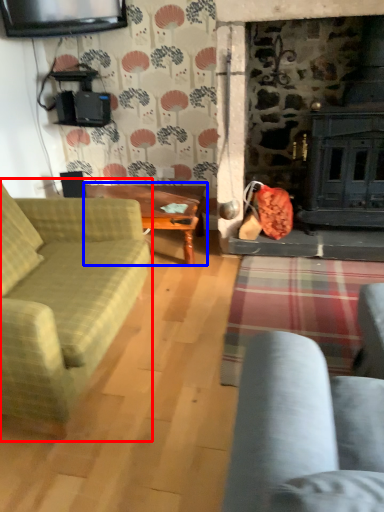
Question: Which point is further to the camera, studio couch (highlighted by a red box) or table (highlighted by a blue box)?

Choices:
 (A) studio couch
 (B) table

Answer: (B)